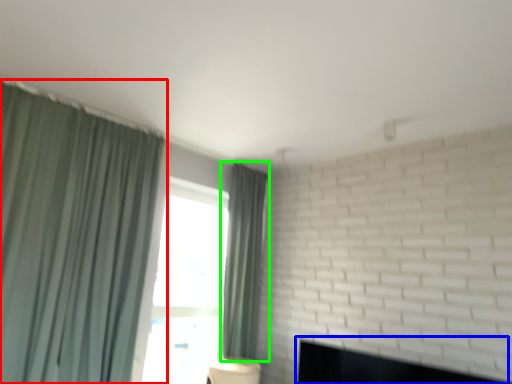
Question: Considering the real-world distances, which object is closest to curtain (highlighted by a red box)? fireplace (highlighted by a blue box) or curtain (highlighted by a green box).

Choices:
 (A) fireplace
 (B) curtain

Answer: (B)